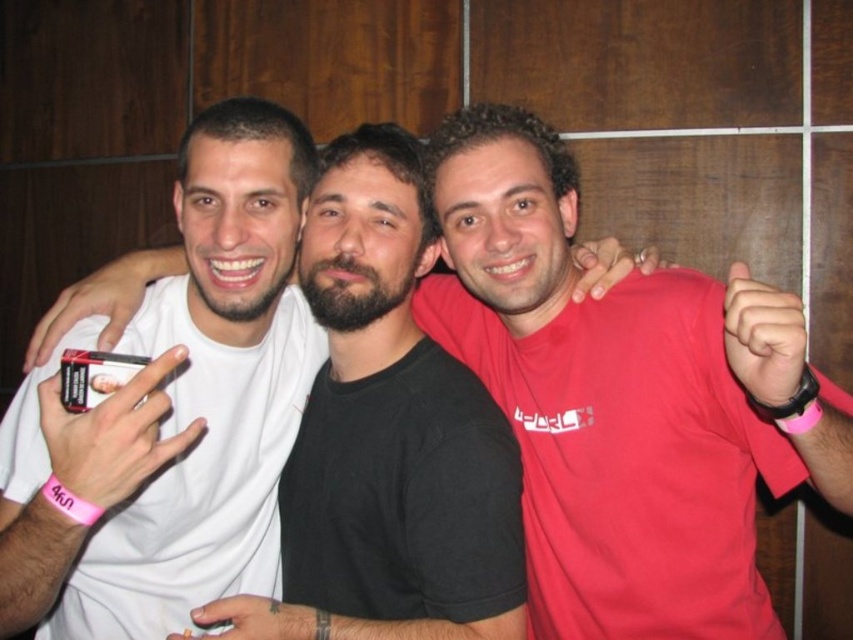
Question: Which object appears closest to the camera in this image?

Choices:
 (A) pink rubber wristband at upper right
 (B) white matte t-shirt at center

Answer: (A)

Question: Is pink rubber wristband at upper right positioned in front of white matte t-shirt at center?

Choices:
 (A) yes
 (B) no

Answer: (A)

Question: Is pink rubber wristband at upper right to the right of white matte t-shirt at center from the viewer's perspective?

Choices:
 (A) no
 (B) yes

Answer: (B)

Question: Is pink rubber wristband at upper right further to camera compared to white matte t-shirt at center?

Choices:
 (A) no
 (B) yes

Answer: (A)

Question: Which point is farther to the camera?

Choices:
 (A) (299, 634)
 (B) (726, 520)

Answer: (B)